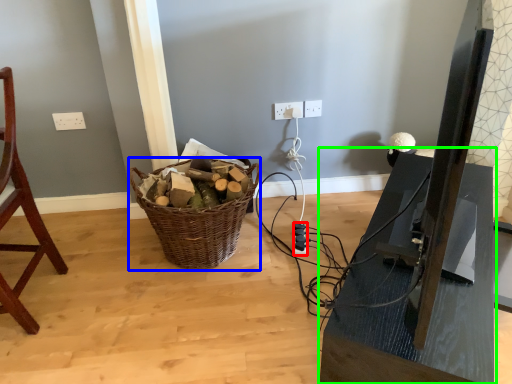
Question: Which object is the farthest from extension cord (highlighted by a red box)? Choose among these: basket (highlighted by a blue box) or table (highlighted by a green box).

Choices:
 (A) basket
 (B) table

Answer: (B)